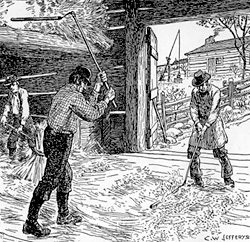
The height and width of the screenshot is (242, 250). In order to click on door in this screenshot , I will do `click(152, 83)`.